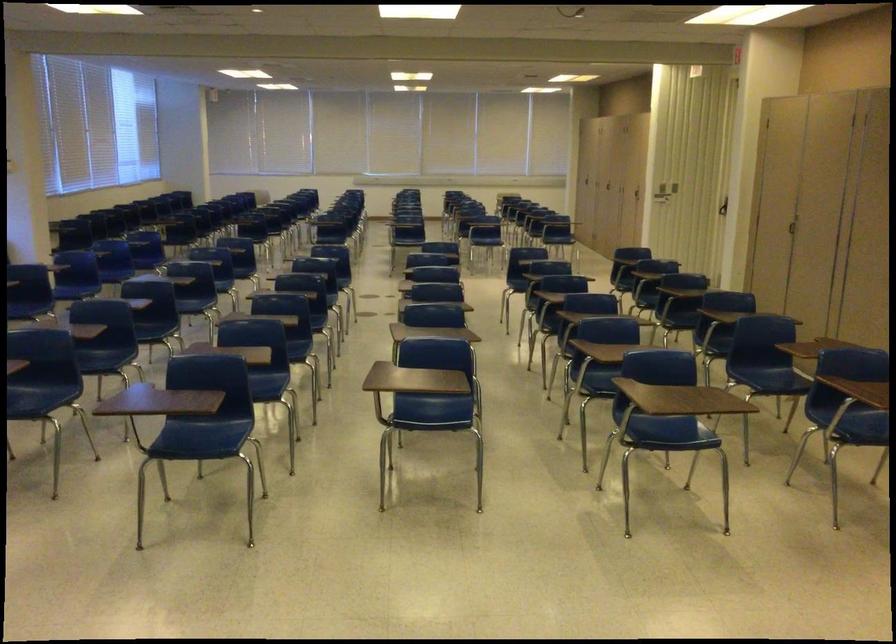
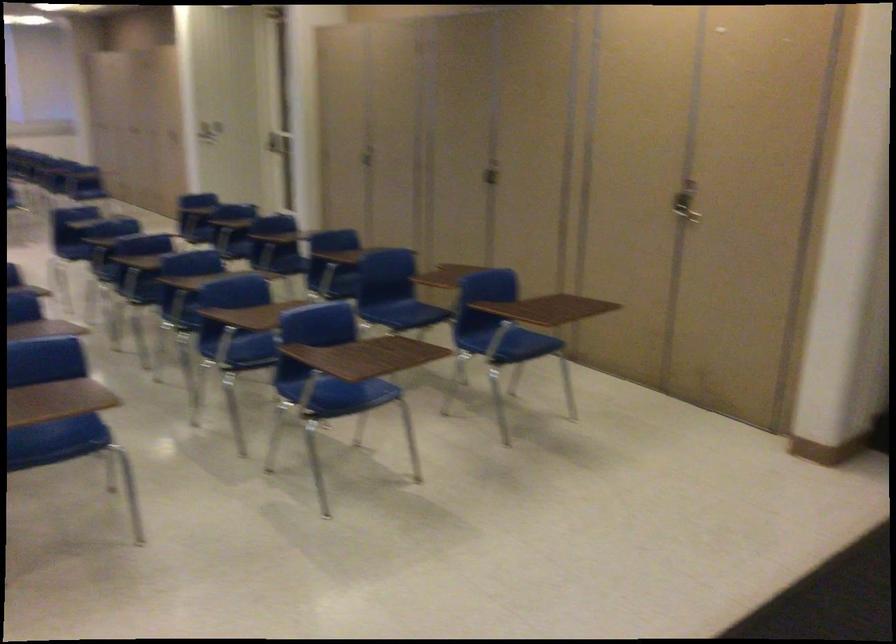
Question: The first image is from the beginning of the video and the second image is from the end. How did the camera likely rotate when shooting the video?

Choices:
 (A) Left
 (B) Right
 (C) Up
 (D) Down

Answer: (B)